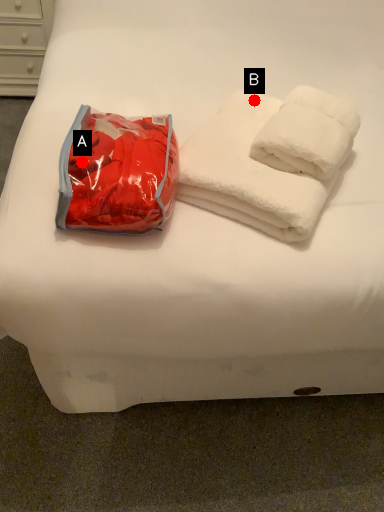
Question: Two points are circled on the image, labeled by A and B beside each circle. Which point is farther to the camera?

Choices:
 (A) A is further
 (B) B is further

Answer: (B)